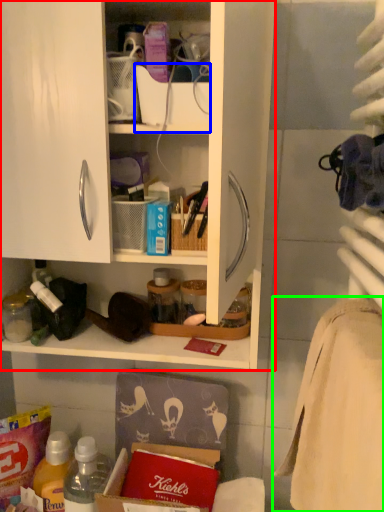
Question: Considering the real-world distances, which object is closest to cabinetry (highlighted by a red box)? box (highlighted by a blue box) or bath towel (highlighted by a green box).

Choices:
 (A) box
 (B) bath towel

Answer: (A)